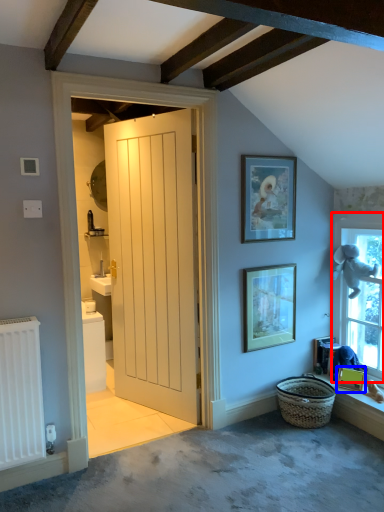
Question: Which object is closer to the camera taking this photo, window (highlighted by a red box) or picture frame (highlighted by a blue box)?

Choices:
 (A) window
 (B) picture frame

Answer: (A)